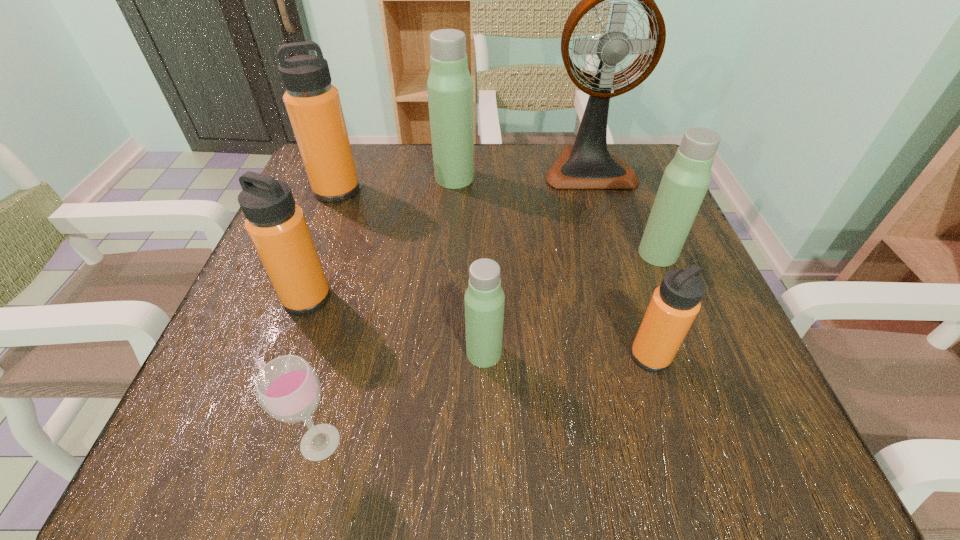
Locate an element on the screen. The image size is (960, 540). brown fan is located at coordinates (587, 164).

Identify the location of the tallest object. The image size is (960, 540). (587, 164).

Image resolution: width=960 pixels, height=540 pixels. Identify the location of the biggest orange thermos bottle. (313, 104).

Identify the location of the biggest light thermos bottle. The width and height of the screenshot is (960, 540). (449, 86).

The height and width of the screenshot is (540, 960). Identify the location of the rightmost thermos bottle. (686, 179).

Where is `the fifth nearest object`? This screenshot has width=960, height=540. the fifth nearest object is located at coordinates (686, 179).

At what (x,y) coordinates should I click in order to perform the action: click on the second smallest orange thermos bottle. Please return your answer as a coordinate pair (x, y). Looking at the image, I should click on (x=277, y=227).

This screenshot has width=960, height=540. I want to click on the second farthest orange thermos bottle, so click(x=277, y=227).

Identify the location of the smallest light thermos bottle. The image size is (960, 540). (484, 298).

Where is `the smallest orange thermos bottle`? The height and width of the screenshot is (540, 960). the smallest orange thermos bottle is located at coordinates (674, 305).